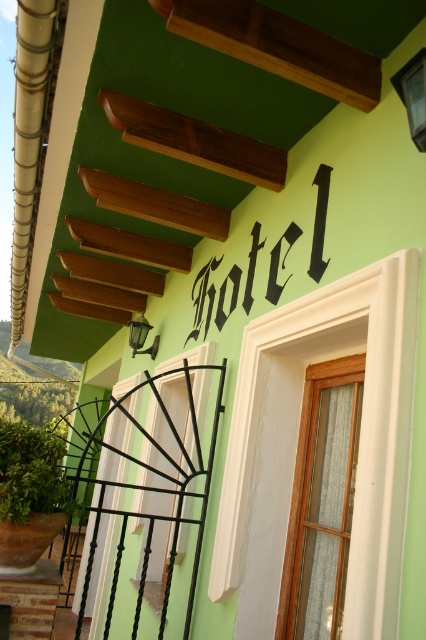
Is point (164, 452) positioned behind point (152, 356)?

No, it is in front of (152, 356).

Is black wrought iron at center to the left of matte black lamp at upper center from the viewer's perspective?

Yes, black wrought iron at center is to the left of matte black lamp at upper center.

Who is more forward, (101, 541) or (143, 352)?

Positioned in front is point (143, 352).

Where is `black wrought iron at center`? The height and width of the screenshot is (640, 426). black wrought iron at center is located at coordinates (141, 502).

Find the location of a particular element. The width and height of the screenshot is (426, 640). blackmaterial/texturehotel at upper center is located at coordinates (319, 221).

Is blackmaterial/texturehotel at upper center thinner than matte black lamp at upper center?

No.

Which is behind, point (207, 289) or point (132, 336)?

The point (132, 336) is behind.

Locate an element on the screen. This screenshot has height=640, width=426. blackmaterial/texturehotel at upper center is located at coordinates (319, 221).

Describe the element at coordinates (141, 502) in the screenshot. I see `black wrought iron at center` at that location.

Where is `black wrought iron at center`? The height and width of the screenshot is (640, 426). black wrought iron at center is located at coordinates (141, 502).

Between point (210, 442) and point (321, 172), which one is positioned behind?

Point (210, 442)

Where is `black wrought iron at center`? This screenshot has width=426, height=640. black wrought iron at center is located at coordinates (141, 502).